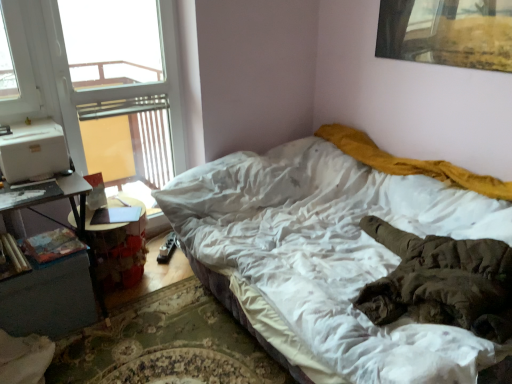
This screenshot has height=384, width=512. In order to click on free space above hardcover book at lower left, acting as the second book starting from the left (from a real-world perspective) in this screenshot , I will do `click(54, 245)`.